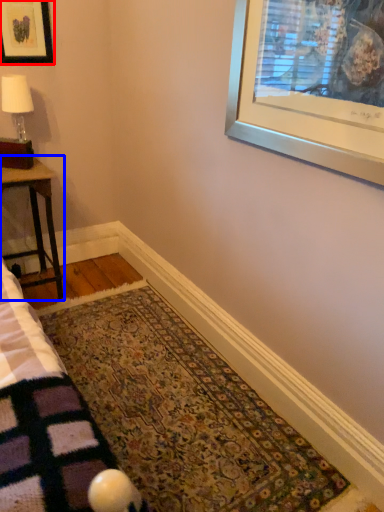
Question: Which object is further to the camera taking this photo, picture frame (highlighted by a red box) or table (highlighted by a blue box)?

Choices:
 (A) picture frame
 (B) table

Answer: (A)